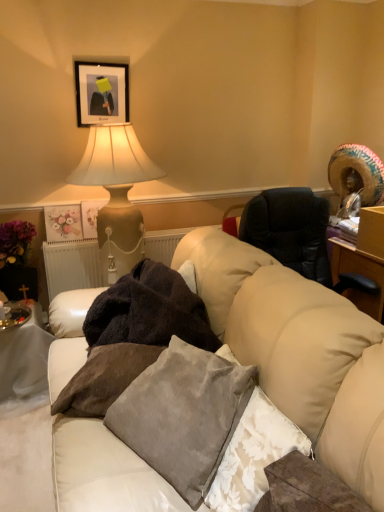
Question: Would you say matte floral print at upper left is a long distance from white leather couch at center?

Choices:
 (A) no
 (B) yes

Answer: (B)

Question: Could white leather couch at center be considered to be inside matte floral print at upper left?

Choices:
 (A) yes
 (B) no

Answer: (B)

Question: From the image's perspective, is matte floral print at upper left over white leather couch at center?

Choices:
 (A) no
 (B) yes

Answer: (B)

Question: Is matte floral print at upper left positioned beyond the bounds of white leather couch at center?

Choices:
 (A) yes
 (B) no

Answer: (A)

Question: Does matte floral print at upper left have a lesser height compared to white leather couch at center?

Choices:
 (A) no
 (B) yes

Answer: (B)

Question: Considering the relative positions of matte floral print at upper left and white leather couch at center in the image provided, is matte floral print at upper left behind white leather couch at center?

Choices:
 (A) yes
 (B) no

Answer: (A)

Question: Is matte floral print at upper left not near multicolored woven straw hat at upper right?

Choices:
 (A) yes
 (B) no

Answer: (A)

Question: Can you confirm if matte floral print at upper left is taller than multicolored woven straw hat at upper right?

Choices:
 (A) yes
 (B) no

Answer: (B)

Question: Is matte floral print at upper left positioned before multicolored woven straw hat at upper right?

Choices:
 (A) yes
 (B) no

Answer: (B)

Question: Does matte floral print at upper left have a larger size compared to multicolored woven straw hat at upper right?

Choices:
 (A) yes
 (B) no

Answer: (B)

Question: From a real-world perspective, is matte floral print at upper left on top of multicolored woven straw hat at upper right?

Choices:
 (A) no
 (B) yes

Answer: (A)

Question: Does matte floral print at upper left have a greater width compared to multicolored woven straw hat at upper right?

Choices:
 (A) no
 (B) yes

Answer: (A)

Question: Are white fabric table at lower left and matte beige lamp at upper left located far from each other?

Choices:
 (A) yes
 (B) no

Answer: (B)